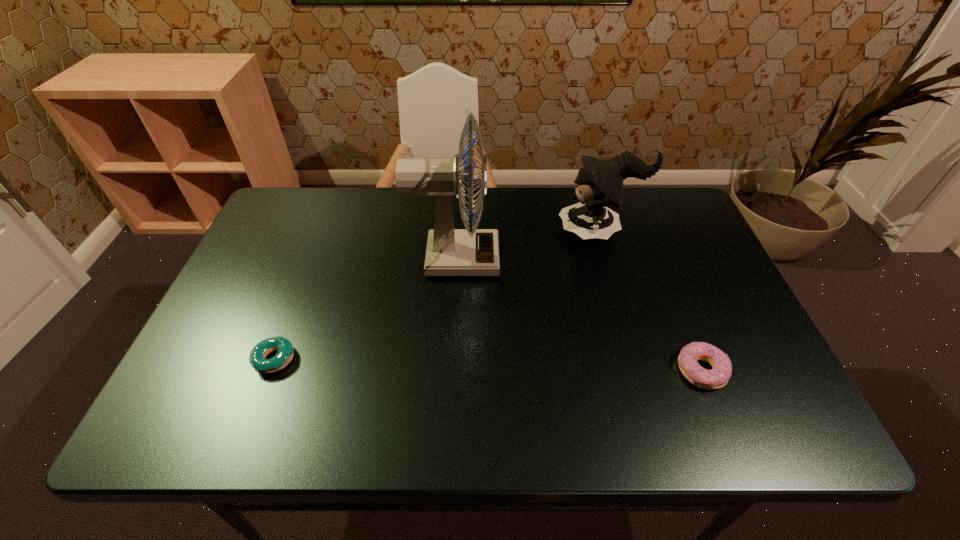
This screenshot has width=960, height=540. I want to click on free space at the right edge, so click(698, 248).

Identify the location of vacant space at the far left corner. (x=281, y=234).

I want to click on free point between the taller doughnut and the fan, so click(578, 315).

The height and width of the screenshot is (540, 960). I want to click on vacant space that's between the left doughnut and the doll, so click(x=437, y=295).

Find the location of a particular element. Image resolution: width=960 pixels, height=540 pixels. free spot between the second tallest object and the tallest object is located at coordinates pyautogui.click(x=527, y=245).

You are a GUI agent. You are given a task and a screenshot of the screen. Output one action in this format:
    pyautogui.click(x=<x>, y=<y>)
    Task: Click on the free space between the third shortest object and the taller doughnut
    This screenshot has height=540, width=960.
    Given the screenshot: What is the action you would take?
    pyautogui.click(x=651, y=301)

At what (x,y) coordinates should I click in order to perform the action: click on free space between the third tallest object and the third object from right to left. Please return your answer as a coordinate pair (x, y). Image resolution: width=960 pixels, height=540 pixels. Looking at the image, I should click on (578, 315).

Identify the location of blank region between the doll and the shorter doughnut. (437, 295).

This screenshot has height=540, width=960. Find the location of `free space that is in between the third tallest object and the third shortest object`. free space that is in between the third tallest object and the third shortest object is located at coordinates (651, 301).

Locate an element on the screen. empty location between the third shortest object and the tallest object is located at coordinates (527, 245).